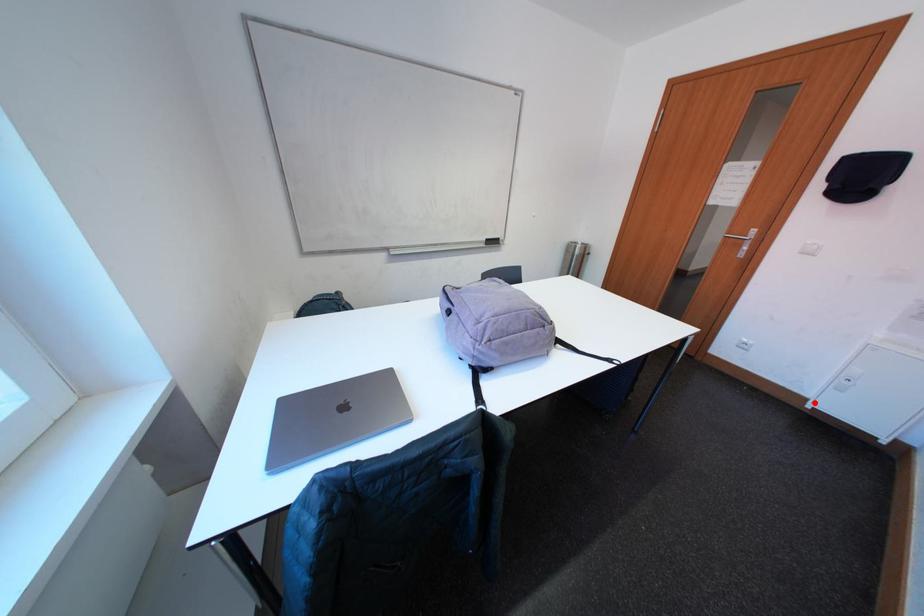
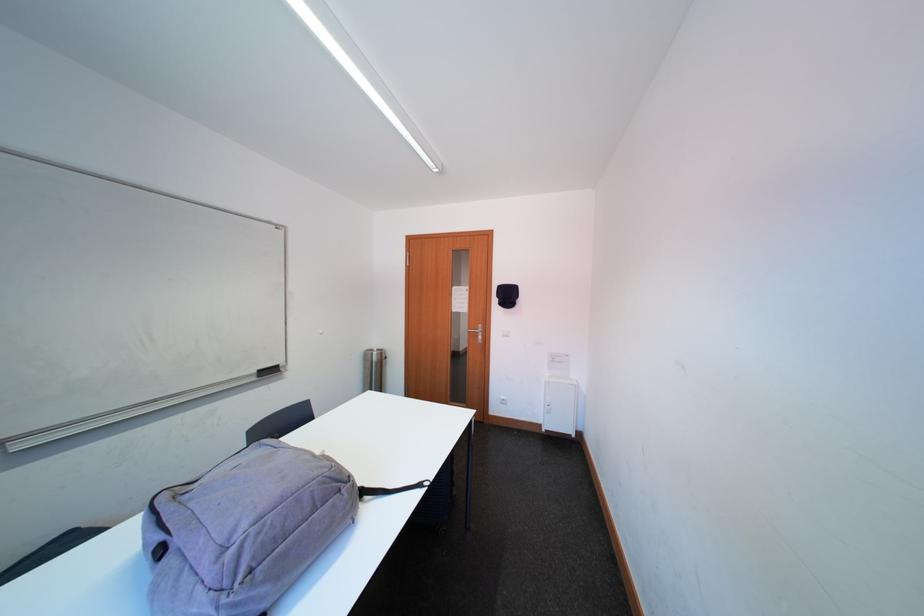
Question: I am providing you with two images of the same scene from different viewpoints. Given a red point in image1, look at the same physical point in image2. Is it:

Choices:
 (A) Closer to the viewpoint
 (B) Farther from the viewpoint

Answer: (A)